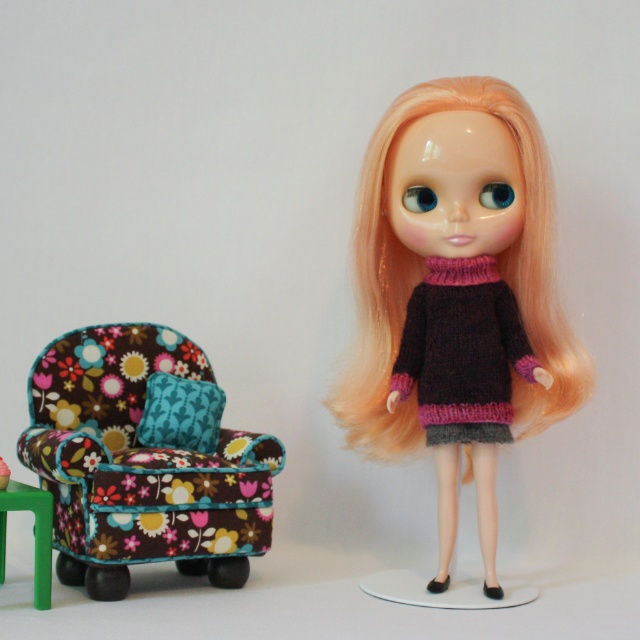
Who is more forward, (225, 490) or (44, 582)?

Point (44, 582)

Where is `floral fabric armchair at left`? Image resolution: width=640 pixels, height=640 pixels. floral fabric armchair at left is located at coordinates (144, 460).

The image size is (640, 640). What are the coordinates of `floral fabric armchair at left` in the screenshot? It's located at tap(144, 460).

Measure the distance between blondehair at right and black knitted sweater at center.

A distance of 3.39 inches exists between blondehair at right and black knitted sweater at center.

Between point (541, 192) and point (518, 340), which one is positioned in front?

Point (541, 192) is in front.

The width and height of the screenshot is (640, 640). Find the location of `blondehair at right`. blondehair at right is located at coordinates (422, 273).

Does black knitted sweater at center appear on the left side of green plastic stool at lower left?

No, black knitted sweater at center is not to the left of green plastic stool at lower left.

How much distance is there between black knitted sweater at center and green plastic stool at lower left?

black knitted sweater at center and green plastic stool at lower left are 30.01 inches apart from each other.

Which is in front, point (500, 435) or point (42, 564)?

Point (42, 564) is in front.

At what (x,y) coordinates should I click in order to perform the action: click on black knitted sweater at center. Please return your answer as a coordinate pair (x, y). Image resolution: width=640 pixels, height=640 pixels. Looking at the image, I should click on (461, 352).